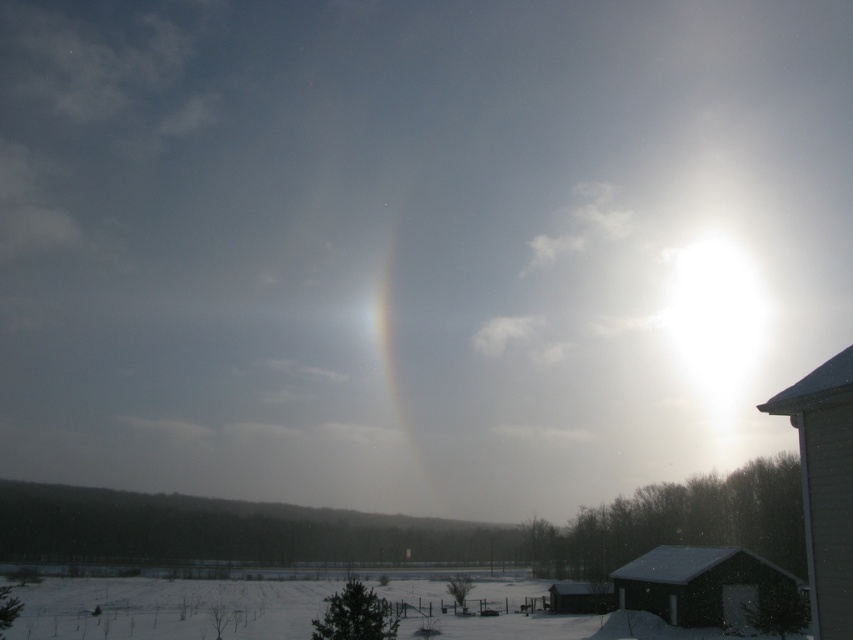
From the picture: You are standing at the edge of the snow field and want to reach the wooden cabin at lower center. There is a dark gray wooden hut at lower right in your way. Which direction should you move to avoid the hut and reach the cabin?

You should move towards the left to avoid the dark gray wooden hut at lower right and reach the wooden cabin at lower center since the hut is in front of the cabin, meaning the cabin is behind the hut and to the left.

You are an architect evaluating the placement of a new solar panel array. You need to ensure that the gray wood cabin at right and the dark gray wooden hut at lower right do not cast shadows over the array. Based on the sun position in the image, which structure is more likely to block sunlight to the array?

The dark gray wooden hut at lower right is taller than the gray wood cabin at right, so it is more likely to cast a longer shadow and block sunlight to the array.